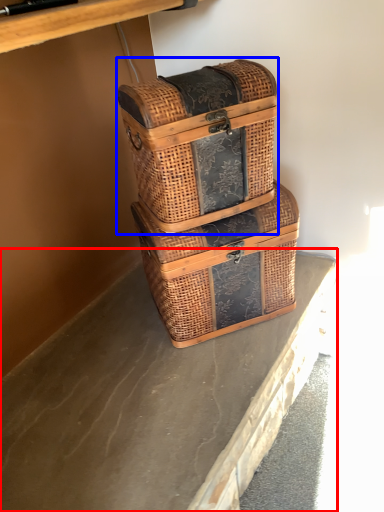
Question: Which object is closer to the camera taking this photo, concrete (highlighted by a red box) or picnic basket (highlighted by a blue box)?

Choices:
 (A) concrete
 (B) picnic basket

Answer: (A)